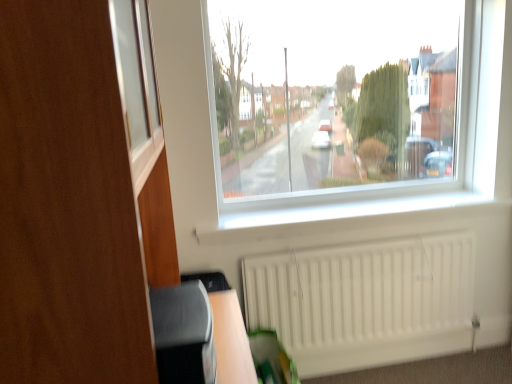
Question: Should I look upward or downward to see matte wood dresser at left?

Choices:
 (A) up
 (B) down

Answer: (B)

Question: Is white matte radiator at lower right to the right of matte wood dresser at left from the viewer's perspective?

Choices:
 (A) yes
 (B) no

Answer: (A)

Question: Does white matte radiator at lower right come in front of matte wood dresser at left?

Choices:
 (A) yes
 (B) no

Answer: (B)

Question: Considering the relative sizes of white matte radiator at lower right and matte wood dresser at left in the image provided, is white matte radiator at lower right shorter than matte wood dresser at left?

Choices:
 (A) no
 (B) yes

Answer: (B)

Question: Considering the relative sizes of white matte radiator at lower right and matte wood dresser at left in the image provided, is white matte radiator at lower right smaller than matte wood dresser at left?

Choices:
 (A) yes
 (B) no

Answer: (A)

Question: Is white matte radiator at lower right located outside matte wood dresser at left?

Choices:
 (A) no
 (B) yes

Answer: (B)

Question: Considering the relative sizes of white matte radiator at lower right and matte wood dresser at left in the image provided, is white matte radiator at lower right taller than matte wood dresser at left?

Choices:
 (A) yes
 (B) no

Answer: (B)

Question: Can you confirm if matte wood dresser at left is positioned to the left of white matte radiator at lower right?

Choices:
 (A) yes
 (B) no

Answer: (A)

Question: Can you confirm if matte wood dresser at left is bigger than white matte radiator at lower right?

Choices:
 (A) yes
 (B) no

Answer: (A)

Question: Is matte wood dresser at left looking in the opposite direction of white matte radiator at lower right?

Choices:
 (A) yes
 (B) no

Answer: (B)

Question: Would you say matte wood dresser at left contains white matte radiator at lower right?

Choices:
 (A) no
 (B) yes

Answer: (A)

Question: Is matte wood dresser at left in front of white matte radiator at lower right?

Choices:
 (A) no
 (B) yes

Answer: (B)

Question: From a real-world perspective, is matte wood dresser at left below white matte radiator at lower right?

Choices:
 (A) no
 (B) yes

Answer: (A)

Question: Considering the positions of point (367, 288) and point (76, 168), is point (367, 288) closer or farther from the camera than point (76, 168)?

Choices:
 (A) farther
 (B) closer

Answer: (A)